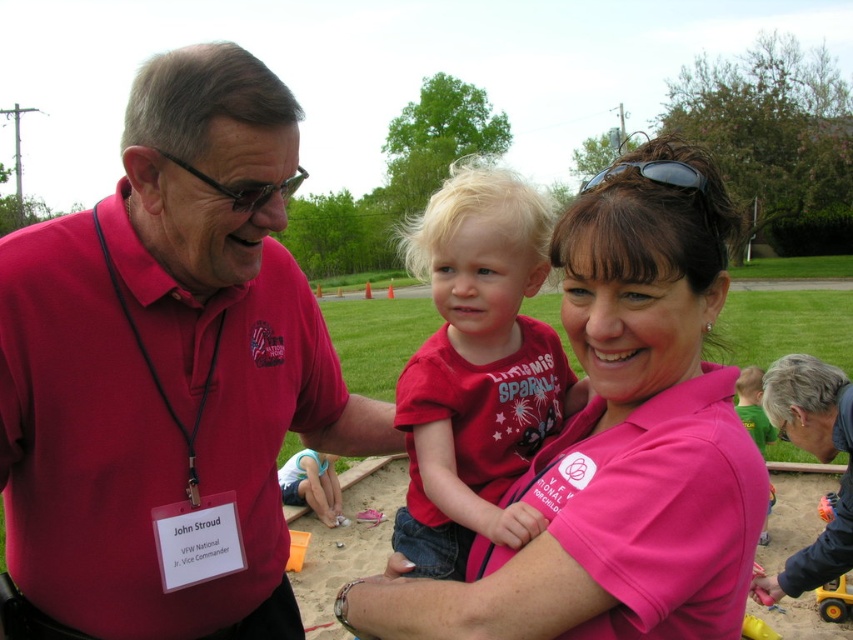
What are the coordinates of the matte red shirt at left in the image?

The matte red shirt at left is located at coordinates point (167, 362).

You are a photographer standing at the center of the scene. You want to take a photo that includes both the matte red shirt at left and the pink fabric shirt at center. Given that your camera has a maximum focus range of 8 feet, will you be able to capture both subjects clearly in the same frame?

The distance between the matte red shirt at left and the pink fabric shirt at center is 8.61 feet, which exceeds the camera maximum focus range of 8 feet. Therefore, you cannot capture both subjects clearly in the same frame.